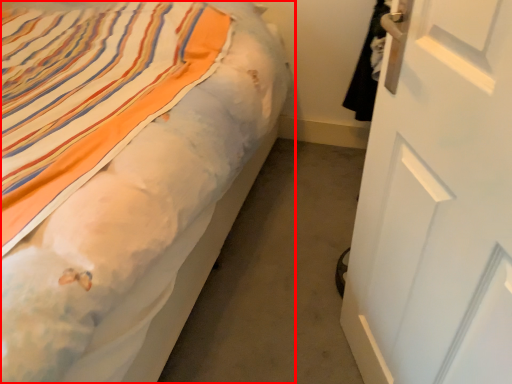
Question: Observing the image, what is the correct spatial positioning of bed (annotated by the red box) in reference to door?

Choices:
 (A) left
 (B) right

Answer: (A)